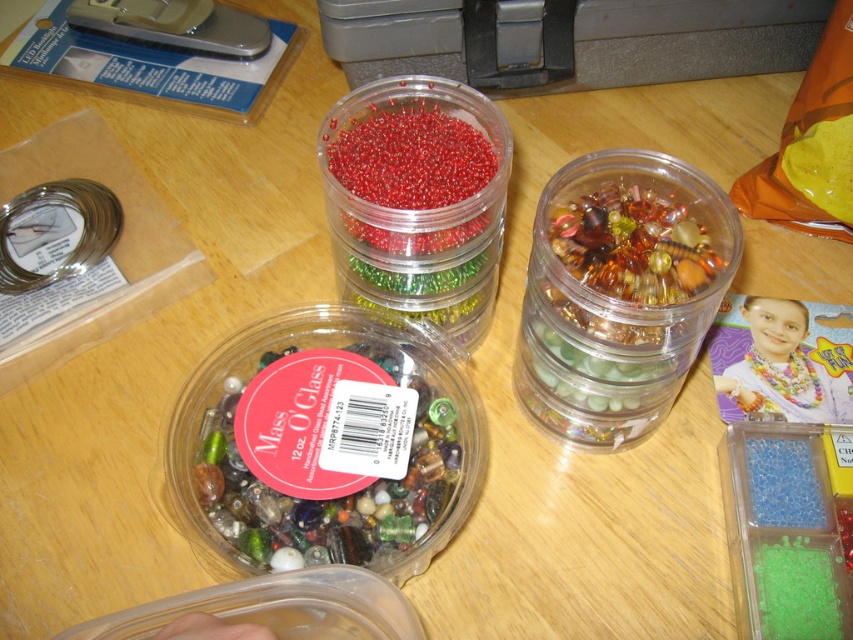
Consider the image. Does red translucent beads at center appear on the right side of blue translucent beads at lower right?

Incorrect, red translucent beads at center is not on the right side of blue translucent beads at lower right.

Is point (396, 230) positioned in front of point (790, 513)?

Yes, it is.

Is point (416, 282) in front of point (773, 449)?

That is True.

Identify the location of red translucent beads at center. The width and height of the screenshot is (853, 640). (418, 198).

Which of these two, translucent plastic beads at upper right or red translucent beads at center, stands shorter?

red translucent beads at center is shorter.

Does translucent plastic beads at upper right have a greater height compared to red translucent beads at center?

Yes.

Which is behind, point (550, 321) or point (495, 157)?

Positioned behind is point (495, 157).

In order to click on translucent plastic beads at upper right in this screenshot , I will do point(619,292).

Is translucent plastic beads at upper right bigger than blue translucent beads at lower right?

Yes.

Can you confirm if translucent plastic beads at upper right is wider than blue translucent beads at lower right?

Yes.

At what (x,y) coordinates should I click in order to perform the action: click on translucent plastic beads at upper right. Please return your answer as a coordinate pair (x, y). The height and width of the screenshot is (640, 853). Looking at the image, I should click on (619, 292).

You are a GUI agent. You are given a task and a screenshot of the screen. Output one action in this format:
    pyautogui.click(x=<x>, y=<y>)
    Task: Click on the translucent plastic beads at upper right
    
    Given the screenshot: What is the action you would take?
    pyautogui.click(x=619, y=292)